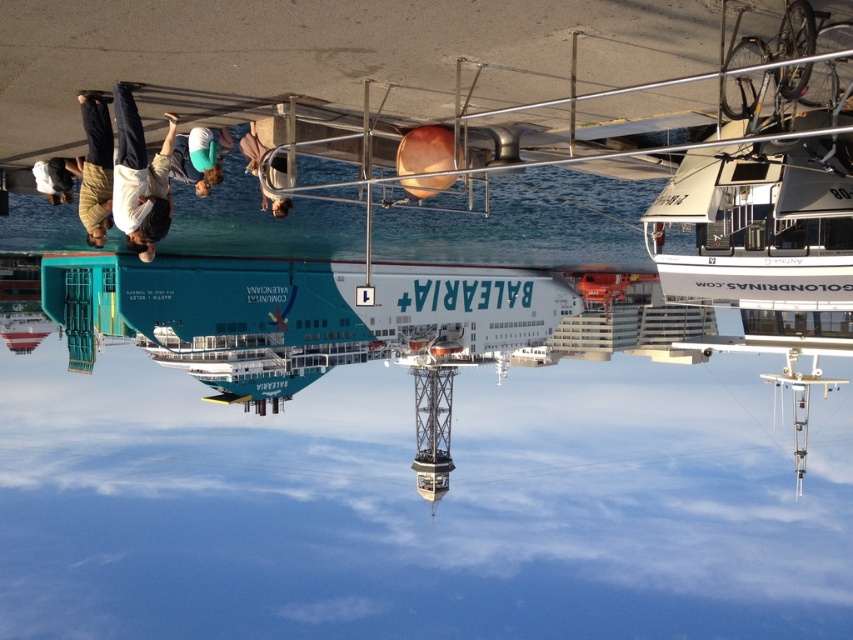
You are a photographer standing on the pier and want to capture a photo of the white glossy boat at upper right without the green fabric shirt at center blocking it. Based on their positions, is this possible?

The white glossy boat at upper right is positioned under the green fabric shirt at center, so the green fabric shirt at center would block the view of the white glossy boat at upper right. Therefore, it is not possible to take a photo of the white glossy boat at upper right without the green fabric shirt at center blocking it.

You are a photographer trying to capture a photo of the waterfront scene with the BALEARIA ferry. You notice two people wearing shirts in the foreground. Which shirt, the light brown shirt at upper left or the white cotton shirt at upper center, is closer to the camera?

The light brown shirt at upper left is closer to the camera because it is in front of the white cotton shirt at upper center.

You are standing on the pier and want to walk towards the ferry. There are two points marked on the image, point 1 at coordinates point [142,134] and point 2 at coordinates point [67,177]. Which point is closer to you as you face the ferry?

Point 1 at coordinates point [142,134] is closer to you because it is closer to the viewer than point 2 at coordinates point [67,177].